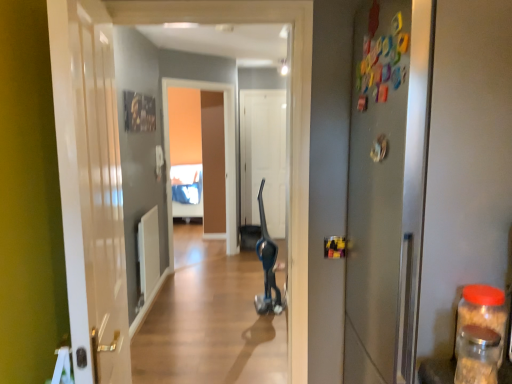
In order to click on wooden floor at center in this screenshot , I will do `click(209, 320)`.

The width and height of the screenshot is (512, 384). What do you see at coordinates (90, 188) in the screenshot?
I see `white glossy door at left, which ranks as the third door in right-to-left order` at bounding box center [90, 188].

What is the approximate width of transparent glass jar at right, the 2th bottle in the back-to-front sequence?

It is 4.21 inches.

Image resolution: width=512 pixels, height=384 pixels. I want to click on wooden floor at center, so click(x=209, y=320).

Starting from the metallic gray door at right, the third door from the left, which bottle is the 2nd one to the left? Please provide its 2D coordinates.

[(477, 355)]

From a real-world perspective, is transparent glass jar at right, the 2th bottle in the back-to-front sequence, on top of metallic gray door at right, the third door from the left?

No.

Would you say metallic gray door at right, the first door from the right, is part of transparent glass jar at right, the 2th bottle in the back-to-front sequence,'s contents?

Answer: No, transparent glass jar at right, the 2th bottle in the back-to-front sequence, does not contain metallic gray door at right, the first door from the right.

Is wooden floor at center in contact with transparent plastic jar at right, acting as the first bottle starting from the back?

No, wooden floor at center is not touching transparent plastic jar at right, acting as the first bottle starting from the back.

Is wooden floor at center at the left side of transparent plastic jar at right, acting as the first bottle starting from the back?

Correct, you'll find wooden floor at center to the left of transparent plastic jar at right, acting as the first bottle starting from the back.

Based on the photo, is wooden floor at center facing towards transparent plastic jar at right, which appears as the 2th bottle when viewed from the front?

Result: No, wooden floor at center is not oriented towards transparent plastic jar at right, which appears as the 2th bottle when viewed from the front.

Based on the photo, how much distance is there between wooden floor at center and transparent plastic jar at right, which appears as the 2th bottle when viewed from the front?

The distance of wooden floor at center from transparent plastic jar at right, which appears as the 2th bottle when viewed from the front, is 8.09 feet.

Could white glossy door at left, placed as the third door when sorted from back to front, be considered to be inside wooden floor at center?

No, wooden floor at center does not contain white glossy door at left, placed as the third door when sorted from back to front.

Is wooden floor at center positioned far away from white glossy door at left, which ranks as the first door in front-to-back order?

Absolutely, wooden floor at center is distant from white glossy door at left, which ranks as the first door in front-to-back order.

Which point is more distant from viewer, (185, 342) or (105, 365)?

The point (185, 342) is behind.

From a real-world perspective, is wooden floor at center physically below white glossy door at left, which is the first door in left-to-right order?

Yes, from a real-world perspective, wooden floor at center is beneath white glossy door at left, which is the first door in left-to-right order.

From the image's perspective, does wooden floor at center appear lower than transparent glass jar at right, the 1th bottle viewed from the front?

Correct, wooden floor at center appears lower than transparent glass jar at right, the 1th bottle viewed from the front, in the image.

Is wooden floor at center positioned behind transparent glass jar at right, the 1th bottle viewed from the front?

Yes, the depth of wooden floor at center is greater than that of transparent glass jar at right, the 1th bottle viewed from the front.

Find the location of a particular element. the 1st bottle positioned above the wooden floor at center (from the image's perspective) is located at coordinates (477, 355).

Considering the positions of point (281, 366) and point (492, 333), is point (281, 366) closer or farther from the camera than point (492, 333)?

Point (281, 366) appears to be farther away from the viewer than point (492, 333).

Looking at the image, does transparent plastic jar at right, which appears as the 2th bottle when viewed from the front, seem bigger or smaller compared to transparent glass jar at right, the 1th bottle viewed from the front?

In the image, transparent plastic jar at right, which appears as the 2th bottle when viewed from the front, appears to be larger than transparent glass jar at right, the 1th bottle viewed from the front.

Considering the relative sizes of transparent plastic jar at right, acting as the first bottle starting from the back, and transparent glass jar at right, the 2th bottle in the back-to-front sequence, in the image provided, is transparent plastic jar at right, acting as the first bottle starting from the back, wider than transparent glass jar at right, the 2th bottle in the back-to-front sequence,?

Yes.

Is transparent plastic jar at right, acting as the first bottle starting from the back, next to transparent glass jar at right, the 2th bottle in the back-to-front sequence, and touching it?

Yes, transparent plastic jar at right, acting as the first bottle starting from the back, is beside transparent glass jar at right, the 2th bottle in the back-to-front sequence.

Is transparent plastic jar at right, acting as the first bottle starting from the back, bigger than white matte door at center, which ranks as the third door in front-to-back order?

Incorrect, transparent plastic jar at right, acting as the first bottle starting from the back, is not larger than white matte door at center, which ranks as the third door in front-to-back order.

Is transparent plastic jar at right, acting as the first bottle starting from the back, positioned before white matte door at center, acting as the second door starting from the left?

Yes, it is.

Is transparent plastic jar at right, which appears as the 2th bottle when viewed from the front, positioned beyond the bounds of white matte door at center, which ranks as the third door in front-to-back order?

transparent plastic jar at right, which appears as the 2th bottle when viewed from the front, is positioned outside white matte door at center, which ranks as the third door in front-to-back order.

From the image's perspective, is transparent plastic jar at right, acting as the first bottle starting from the back, positioned above or below white matte door at center, marked as the first door in a back-to-front arrangement?

Based on their image positions, transparent plastic jar at right, acting as the first bottle starting from the back, is located beneath white matte door at center, marked as the first door in a back-to-front arrangement.

Is wooden floor at center a part of white glossy door at left, which ranks as the first door in front-to-back order?

No, wooden floor at center is located outside of white glossy door at left, which ranks as the first door in front-to-back order.

From a real-world perspective, does white glossy door at left, which ranks as the first door in front-to-back order, stand above wooden floor at center?

Yes, from a real-world perspective, white glossy door at left, which ranks as the first door in front-to-back order, is on top of wooden floor at center.

Which is closer to the camera, (122, 277) or (186, 233)?

The point (122, 277) is in front.

Is white glossy door at left, which ranks as the first door in front-to-back order, further to the viewer compared to wooden floor at center?

No, white glossy door at left, which ranks as the first door in front-to-back order, is closer to the camera.

The width and height of the screenshot is (512, 384). Identify the location of the 2nd door above the transparent glass jar at right, the 2th bottle in the back-to-front sequence (from the image's perspective). pyautogui.click(x=387, y=188).

What are the coordinates of `bottle that is the 2nd one when counting rightward from the wooden floor at center` in the screenshot? It's located at (483, 310).

Based on their spatial positions, is white matte door at center, acting as the second door starting from the left, or transparent plastic jar at right, acting as the first bottle starting from the back, closer to transparent glass jar at right, the 1th bottle viewed from the front?

Among the two, transparent plastic jar at right, acting as the first bottle starting from the back, is located nearer to transparent glass jar at right, the 1th bottle viewed from the front.

Looking at the image, which one is located further to wooden floor at center, transparent glass jar at right, the 1th bottle viewed from the front, or transparent plastic jar at right, acting as the first bottle starting from the back?

The object further to wooden floor at center is transparent glass jar at right, the 1th bottle viewed from the front.

Estimate the real-world distances between objects in this image. Which object is further from transparent plastic jar at right, which appears as the 2th bottle when viewed from the front, wooden floor at center or white glossy door at left, which ranks as the first door in front-to-back order?

wooden floor at center.

Considering their positions, is metallic gray door at right, the third door from the left, positioned closer to white glossy door at left, placed as the third door when sorted from back to front, than transparent glass jar at right, the 1th bottle viewed from the front?

metallic gray door at right, the third door from the left, is positioned closer to the anchor white glossy door at left, placed as the third door when sorted from back to front.

From the picture: When comparing their distances from transparent glass jar at right, the 1th bottle viewed from the front, does white glossy door at left, which ranks as the first door in front-to-back order, or white matte door at center, arranged as the second door when viewed from the right, seem closer?

white glossy door at left, which ranks as the first door in front-to-back order, is positioned closer to the anchor transparent glass jar at right, the 1th bottle viewed from the front.

Considering their positions, is white matte door at center, marked as the first door in a back-to-front arrangement, positioned closer to transparent plastic jar at right, acting as the first bottle starting from the back, than white glossy door at left, which is the first door in left-to-right order?

Based on the image, white glossy door at left, which is the first door in left-to-right order, appears to be nearer to transparent plastic jar at right, acting as the first bottle starting from the back.

Looking at the image, which one is located further to wooden floor at center, metallic gray door at right, which is the 2th door from back to front, or transparent plastic jar at right, which appears as the 2th bottle when viewed from the front?

transparent plastic jar at right, which appears as the 2th bottle when viewed from the front.

Which object lies nearer to the anchor point metallic gray door at right, which is the 2th door from back to front, wooden floor at center or white matte door at center, arranged as the second door when viewed from the right?

Among the two, wooden floor at center is located nearer to metallic gray door at right, which is the 2th door from back to front.

This screenshot has height=384, width=512. What are the coordinates of `bottle situated between white glossy door at left, which ranks as the first door in front-to-back order, and transparent plastic jar at right, which appears as the 2th bottle when viewed from the front, from left to right` in the screenshot? It's located at (477, 355).

I want to click on alley between metallic gray door at right, the first door from the right, and white matte door at center, marked as the first door in a back-to-front arrangement, along the z-axis, so pyautogui.click(x=209, y=320).

You are a GUI agent. You are given a task and a screenshot of the screen. Output one action in this format:
    pyautogui.click(x=<x>, y=<y>)
    Task: Click on the door positioned between transparent glass jar at right, the 2th bottle in the back-to-front sequence, and wooden floor at center from near to far
    The image size is (512, 384).
    Given the screenshot: What is the action you would take?
    pyautogui.click(x=387, y=188)

Where is `alley positioned between transparent plastic jar at right, which appears as the 2th bottle when viewed from the front, and white matte door at center, which ranks as the third door in front-to-back order, from near to far`? alley positioned between transparent plastic jar at right, which appears as the 2th bottle when viewed from the front, and white matte door at center, which ranks as the third door in front-to-back order, from near to far is located at coordinates coord(209,320).